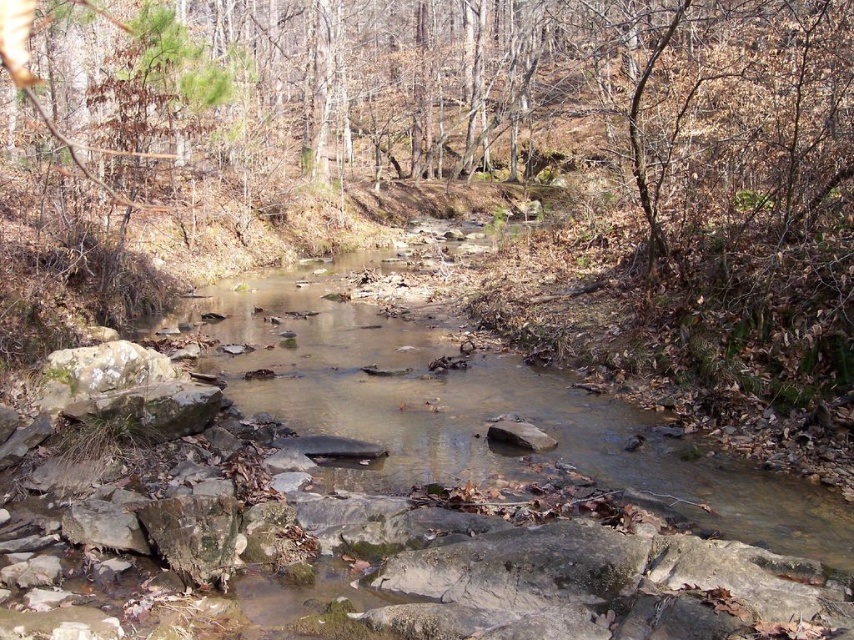
Is clear water stream at center to the right of smooth gray rock at center from the viewer's perspective?

Incorrect, clear water stream at center is not on the right side of smooth gray rock at center.

Is point (512, 461) less distant than point (490, 426)?

Yes.

Find the location of a particular element. clear water stream at center is located at coordinates (478, 410).